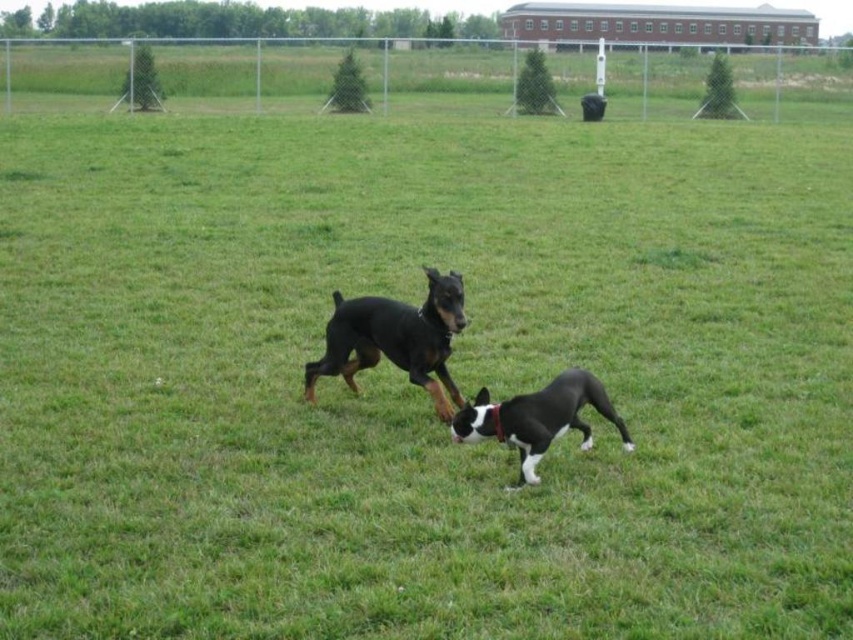
Who is more distant from viewer, (349, 380) or (538, 435)?

The point (349, 380) is behind.

Can you confirm if black smooth doberman at center is positioned to the left of black matte dog at center?

Yes, black smooth doberman at center is to the left of black matte dog at center.

Which is in front, point (361, 344) or point (544, 428)?

Point (544, 428) is more forward.

This screenshot has height=640, width=853. I want to click on black smooth doberman at center, so click(395, 339).